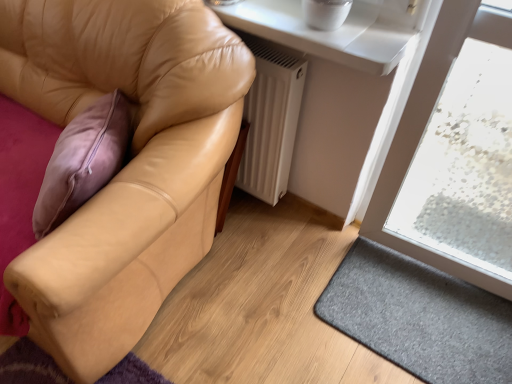
Question: From a real-world perspective, relative to white glossy window sill at upper center, is tan leather couch at left vertically above or below?

Choices:
 (A) below
 (B) above

Answer: (A)

Question: In terms of width, does tan leather couch at left look wider or thinner when compared to white glossy window sill at upper center?

Choices:
 (A) wide
 (B) thin

Answer: (A)

Question: Which of these objects is positioned closest to the white glossy window sill at upper center?

Choices:
 (A) tan leather couch at left
 (B) white matte radiator at lower center
 (C) gray felt doormat at lower right

Answer: (B)

Question: Which is nearer to the white glossy window sill at upper center?

Choices:
 (A) tan leather couch at left
 (B) white matte radiator at lower center
 (C) gray felt doormat at lower right

Answer: (B)